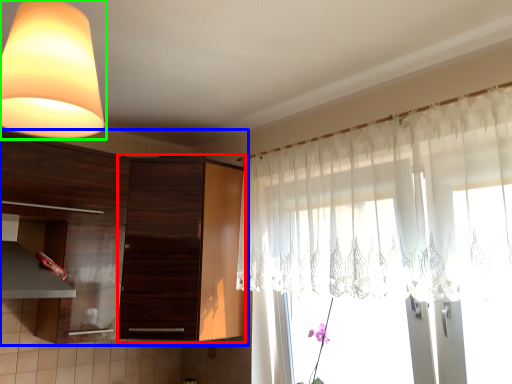
Question: Considering the real-world distances, which object is closest to cabinetry (highlighted by a red box)? cabinetry (highlighted by a blue box) or lamp (highlighted by a green box).

Choices:
 (A) cabinetry
 (B) lamp

Answer: (A)